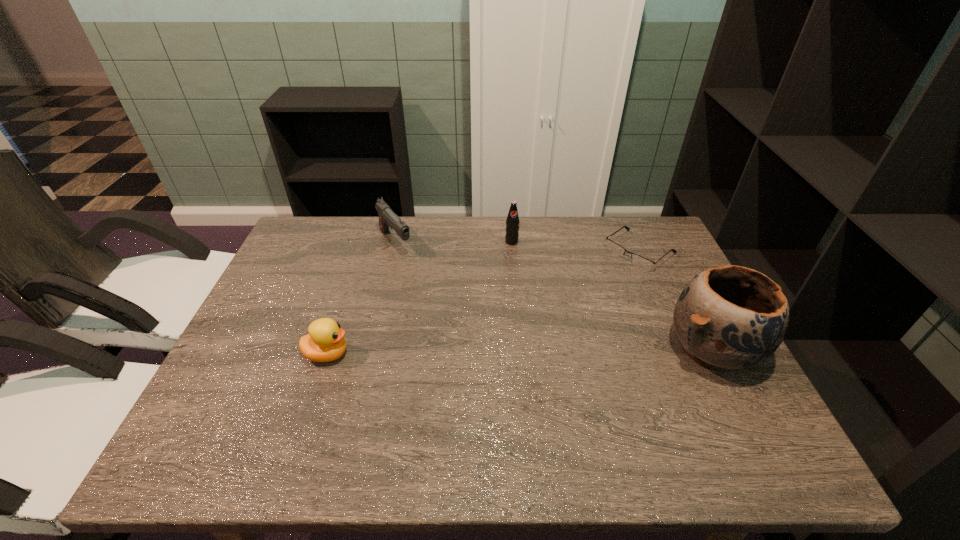
Where is `free space located 0.080m on the front-facing side of the shortest object`? free space located 0.080m on the front-facing side of the shortest object is located at coordinates (604, 278).

Where is `free space located on the front-facing side of the shortest object`? This screenshot has width=960, height=540. free space located on the front-facing side of the shortest object is located at coordinates (571, 303).

I want to click on vacant space located 0.390m on the front-facing side of the shortest object, so click(x=532, y=334).

Locate an element on the screen. The width and height of the screenshot is (960, 540). free region located on the front label of the third object from right to left is located at coordinates (540, 313).

Find the location of a particular element. vacant region located 0.100m on the front label of the third object from right to left is located at coordinates (521, 266).

You are a GUI agent. You are given a task and a screenshot of the screen. Output one action in this format:
    pyautogui.click(x=<x>, y=<y>)
    Task: Click on the vacant space positioned on the front label of the third object from right to left
    
    Given the screenshot: What is the action you would take?
    pyautogui.click(x=521, y=266)

The image size is (960, 540). I want to click on gun present at the far edge, so click(x=387, y=218).

You are a GUI agent. You are given a task and a screenshot of the screen. Output one action in this format:
    pyautogui.click(x=<x>, y=<y>)
    Task: Click on the spectacles at the far edge
    The image size is (960, 540).
    Given the screenshot: What is the action you would take?
    pyautogui.click(x=639, y=261)

Locate an element on the screen. This screenshot has height=540, width=960. pop at the far edge is located at coordinates pyautogui.click(x=512, y=222).

The width and height of the screenshot is (960, 540). In order to click on object at the near edge in this screenshot , I will do `click(728, 317)`.